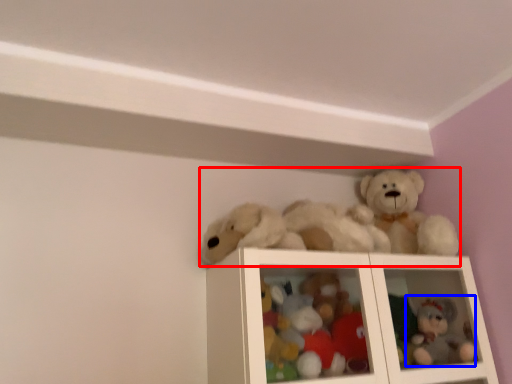
Question: Which point is further to the camera, toy (highlighted by a red box) or toy (highlighted by a blue box)?

Choices:
 (A) toy
 (B) toy

Answer: (B)